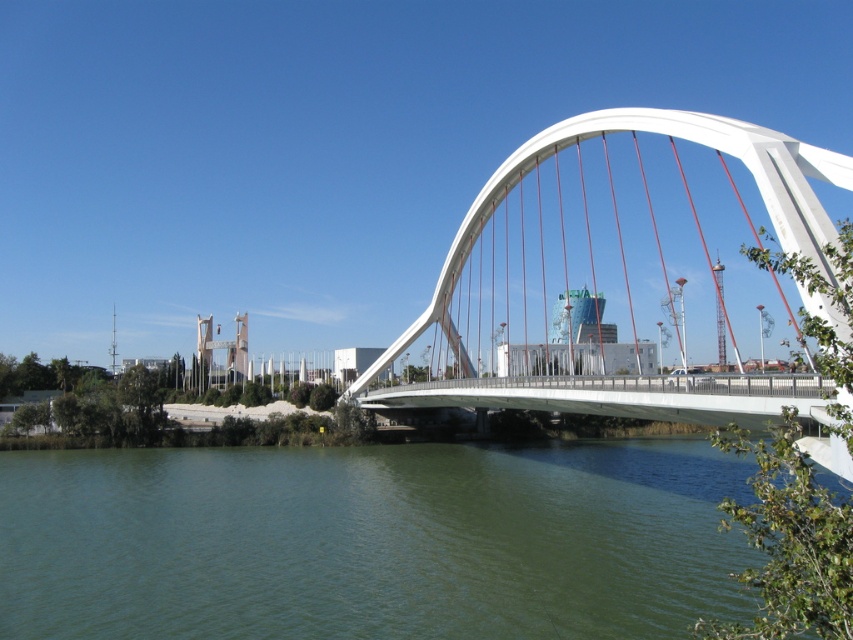
In the scene shown: You are standing on the bridge looking towards the distant urban structures. There are two points marked on the bridge surface, one at coordinates point (524, 477) and the other at point (421, 323). Which of these two points is nearer to your current position on the bridge?

Point (524, 477) is closer to the camera than point (421, 323), so the point at coordinates point (524, 477) is nearer to your current position on the bridge.

You are a drone operator planning to fly a drone over the green water at lower center and the white metallic arch bridge at center. Based on the scene, which area would you estimate is wider?

The green water at lower center might be wider than the white metallic arch bridge at center according to the description.

You are a city planner evaluating the space between the green water at lower center and the white metallic arch bridge at center. Which object takes up more visual space in the image?

The white metallic arch bridge at center takes up more visual space than the green water at lower center because the green water at lower center is smaller than the white metallic arch bridge at center.